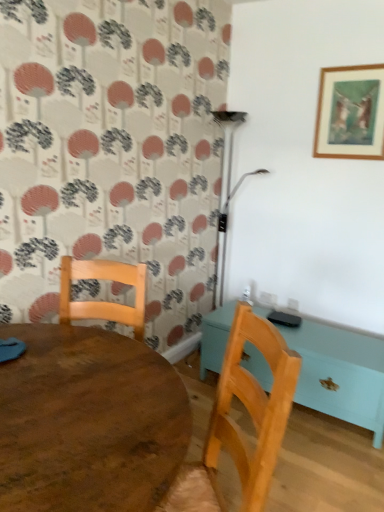
Question: Can wooden table at center, the 1th table from the back, be found inside wooden chair at lower center?

Choices:
 (A) no
 (B) yes

Answer: (A)

Question: Is wooden chair at lower center next to wooden table at center, the 1th table from the back, and touching it?

Choices:
 (A) yes
 (B) no

Answer: (B)

Question: From a real-world perspective, does wooden chair at lower center sit lower than wooden table at center, the 1th table from the right?

Choices:
 (A) no
 (B) yes

Answer: (A)

Question: Are wooden chair at lower center and wooden table at center, marked as the second table in a front-to-back arrangement, far apart?

Choices:
 (A) yes
 (B) no

Answer: (A)

Question: From the image's perspective, would you say wooden chair at lower center is positioned over wooden table at center, the 2th table from the left?

Choices:
 (A) no
 (B) yes

Answer: (B)

Question: Is wooden table at center, which is the second table in right-to-left order, situated inside wooden table at center, the 2th table from the left, or outside?

Choices:
 (A) outside
 (B) inside

Answer: (A)

Question: In the image, is wooden table at center, the 1th table positioned from the left, on the left side or the right side of wooden table at center, the 1th table from the back?

Choices:
 (A) left
 (B) right

Answer: (A)

Question: Considering their positions, is wooden table at center, which is the 2th table from back to front, located in front of or behind wooden table at center, marked as the second table in a front-to-back arrangement?

Choices:
 (A) front
 (B) behind

Answer: (A)

Question: In terms of height, does wooden table at center, which is the 2th table from back to front, look taller or shorter compared to wooden table at center, the 2th table from the left?

Choices:
 (A) tall
 (B) short

Answer: (A)

Question: Is wooden picture frame at upper right inside or outside of metallic silver lamp at upper right?

Choices:
 (A) inside
 (B) outside

Answer: (B)

Question: Is wooden picture frame at upper right in front of or behind metallic silver lamp at upper right in the image?

Choices:
 (A) front
 (B) behind

Answer: (A)

Question: Considering the relative positions of wooden picture frame at upper right and metallic silver lamp at upper right in the image provided, is wooden picture frame at upper right to the left or to the right of metallic silver lamp at upper right?

Choices:
 (A) right
 (B) left

Answer: (A)

Question: Considering the positions of wooden picture frame at upper right and metallic silver lamp at upper right in the image, is wooden picture frame at upper right wider or thinner than metallic silver lamp at upper right?

Choices:
 (A) thin
 (B) wide

Answer: (A)

Question: Is metallic silver lamp at upper right in front of or behind wooden table at center, the 1th table from the right, in the image?

Choices:
 (A) front
 (B) behind

Answer: (B)

Question: From the image's perspective, relative to wooden table at center, marked as the second table in a front-to-back arrangement, is metallic silver lamp at upper right above or below?

Choices:
 (A) below
 (B) above

Answer: (B)